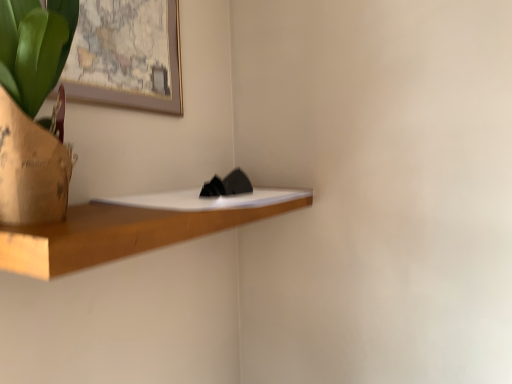
Question: Is wooden shelf at center facing away from wooden framed map at upper left?

Choices:
 (A) yes
 (B) no

Answer: (B)

Question: Is wooden shelf at center wider than wooden framed map at upper left?

Choices:
 (A) no
 (B) yes

Answer: (B)

Question: From a real-world perspective, is wooden shelf at center over wooden framed map at upper left?

Choices:
 (A) no
 (B) yes

Answer: (A)

Question: From a real-world perspective, does wooden shelf at center sit lower than wooden framed map at upper left?

Choices:
 (A) no
 (B) yes

Answer: (B)

Question: Can you confirm if wooden shelf at center is taller than wooden framed map at upper left?

Choices:
 (A) yes
 (B) no

Answer: (B)

Question: Does wooden shelf at center appear on the right side of wooden framed map at upper left?

Choices:
 (A) no
 (B) yes

Answer: (B)

Question: Does wooden framed map at upper left come in front of wooden shelf at center?

Choices:
 (A) no
 (B) yes

Answer: (A)

Question: Considering the relative sizes of wooden framed map at upper left and wooden shelf at center in the image provided, is wooden framed map at upper left taller than wooden shelf at center?

Choices:
 (A) yes
 (B) no

Answer: (A)

Question: Is wooden framed map at upper left thinner than wooden shelf at center?

Choices:
 (A) yes
 (B) no

Answer: (A)

Question: Can you confirm if wooden framed map at upper left is bigger than wooden shelf at center?

Choices:
 (A) yes
 (B) no

Answer: (B)

Question: Considering the relative sizes of wooden framed map at upper left and wooden shelf at center in the image provided, is wooden framed map at upper left shorter than wooden shelf at center?

Choices:
 (A) yes
 (B) no

Answer: (B)

Question: From the image's perspective, is wooden framed map at upper left on wooden shelf at center?

Choices:
 (A) no
 (B) yes

Answer: (B)

Question: Based on their positions, is wooden framed map at upper left located to the left or right of wooden shelf at center?

Choices:
 (A) right
 (B) left

Answer: (B)